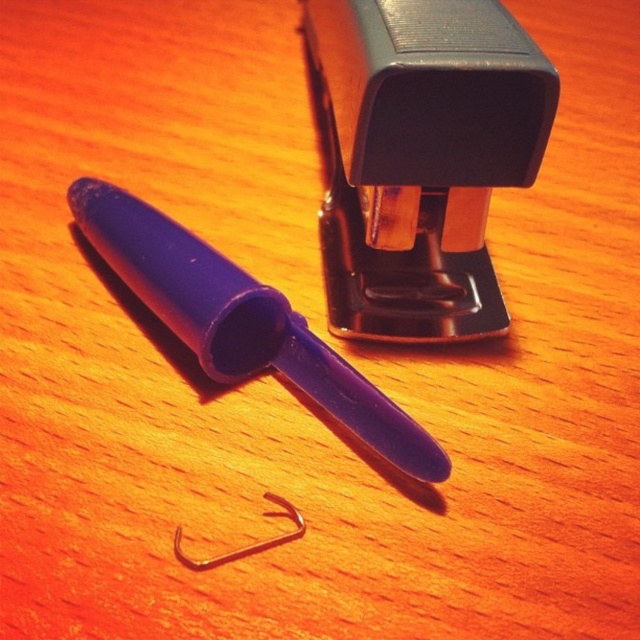
Question: Can you confirm if black plastic stapler at upper center is thinner than silver metallic hook at center?

Choices:
 (A) yes
 (B) no

Answer: (B)

Question: Which object is the closest to the silver metallic hook at center?

Choices:
 (A) black plastic stapler at upper center
 (B) purple plastic pen at center

Answer: (B)

Question: Which point is farther to the camera?

Choices:
 (A) (164, 225)
 (B) (417, 156)

Answer: (A)

Question: Can you confirm if black plastic stapler at upper center is bigger than silver metallic hook at center?

Choices:
 (A) no
 (B) yes

Answer: (B)

Question: Among these points, which one is farthest from the camera?

Choices:
 (A) 176,547
 (B) 412,241
 (C) 202,275

Answer: (B)

Question: Is purple plastic pen at center to the right of silver metallic hook at center from the viewer's perspective?

Choices:
 (A) no
 (B) yes

Answer: (A)